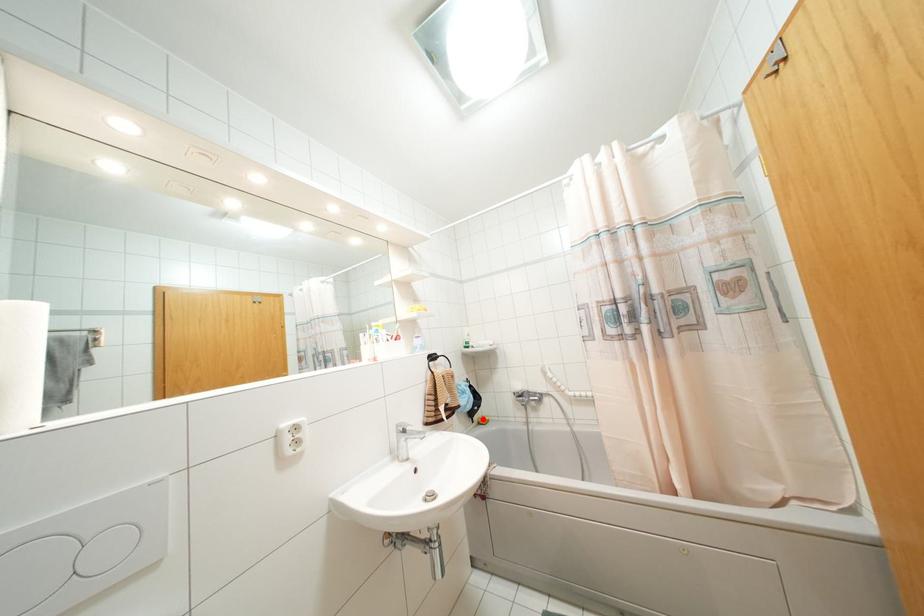
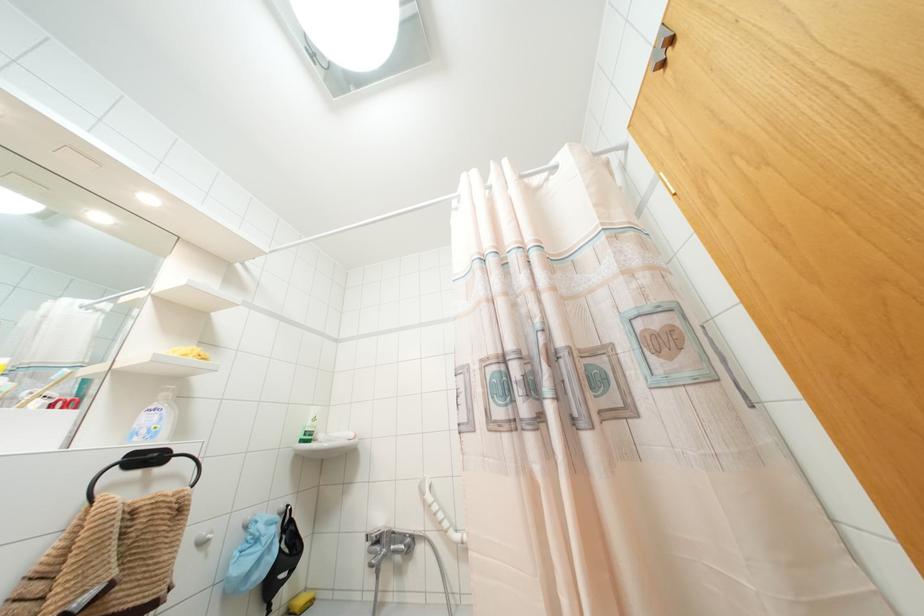
Question: I am providing you with two images of the same scene from different viewpoints. A red point is shown in image1. For the corresponding object point in image2, is it positioned nearer or farther from the camera?

Choices:
 (A) Nearer
 (B) Farther

Answer: (A)